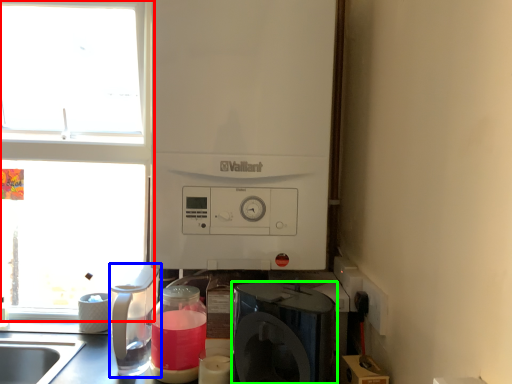
Question: Which is farther away from window (highlighted by a red box)? kitchen appliance (highlighted by a blue box) or home appliance (highlighted by a green box)?

Choices:
 (A) kitchen appliance
 (B) home appliance

Answer: (B)